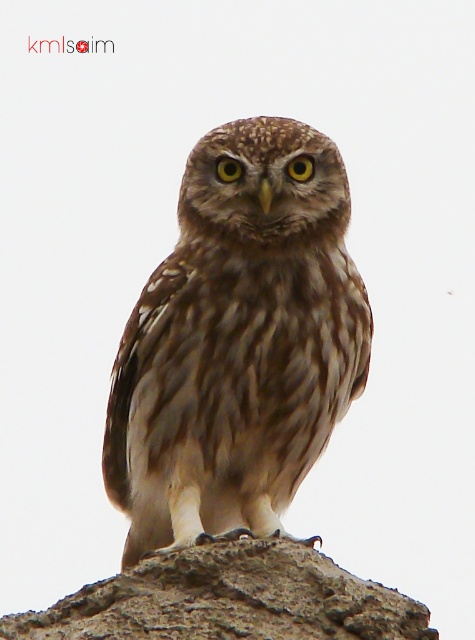
Question: Which point appears farthest from the camera in this image?

Choices:
 (A) (230, 540)
 (B) (196, 417)

Answer: (B)

Question: Can you confirm if brown speckled owl at center is bigger than gray rough stone at center?

Choices:
 (A) no
 (B) yes

Answer: (B)

Question: Among these points, which one is nearest to the camera?

Choices:
 (A) (304, 211)
 (B) (143, 609)

Answer: (B)

Question: Where is brown speckled owl at center located in relation to gray rough stone at center in the image?

Choices:
 (A) left
 (B) right

Answer: (B)

Question: Is brown speckled owl at center smaller than gray rough stone at center?

Choices:
 (A) no
 (B) yes

Answer: (A)